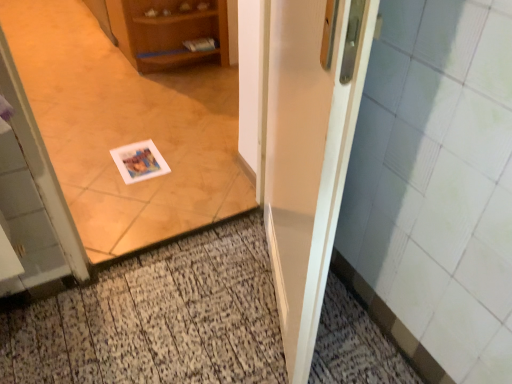
I want to click on free point in front of white paper at center, so click(x=175, y=309).